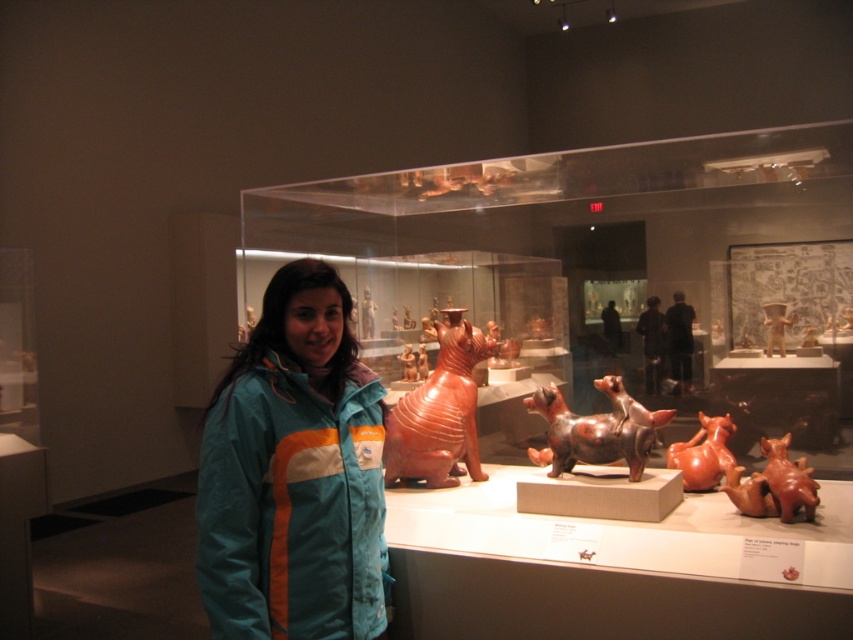
Can you confirm if shiny brown dog at center is positioned above matte orange clay dog at center?

Indeed, shiny brown dog at center is positioned over matte orange clay dog at center.

Can you confirm if shiny brown dog at center is smaller than matte orange clay dog at center?

No, shiny brown dog at center is not smaller than matte orange clay dog at center.

Which is in front, point (590, 435) or point (717, 461)?

Point (590, 435)

Where is `shiny brown dog at center`? The image size is (853, 640). shiny brown dog at center is located at coordinates (595, 429).

Is teal fabric jacket at center to the right of matte terracotta cat at center from the viewer's perspective?

Incorrect, teal fabric jacket at center is not on the right side of matte terracotta cat at center.

Which is in front, point (241, 600) or point (422, 461)?

Point (241, 600) is more forward.

Between point (204, 440) and point (463, 323), which one is positioned in front?

Point (204, 440) is in front.

This screenshot has width=853, height=640. What are the coordinates of `teal fabric jacket at center` in the screenshot? It's located at (294, 474).

Who is shorter, teal fabric jacket at center or shiny brown dog at center?

With less height is shiny brown dog at center.

Does teal fabric jacket at center have a smaller size compared to shiny brown dog at center?

Incorrect, teal fabric jacket at center is not smaller in size than shiny brown dog at center.

You are a GUI agent. You are given a task and a screenshot of the screen. Output one action in this format:
    pyautogui.click(x=<x>, y=<y>)
    Task: Click on the teal fabric jacket at center
    This screenshot has width=853, height=640.
    Given the screenshot: What is the action you would take?
    pyautogui.click(x=294, y=474)